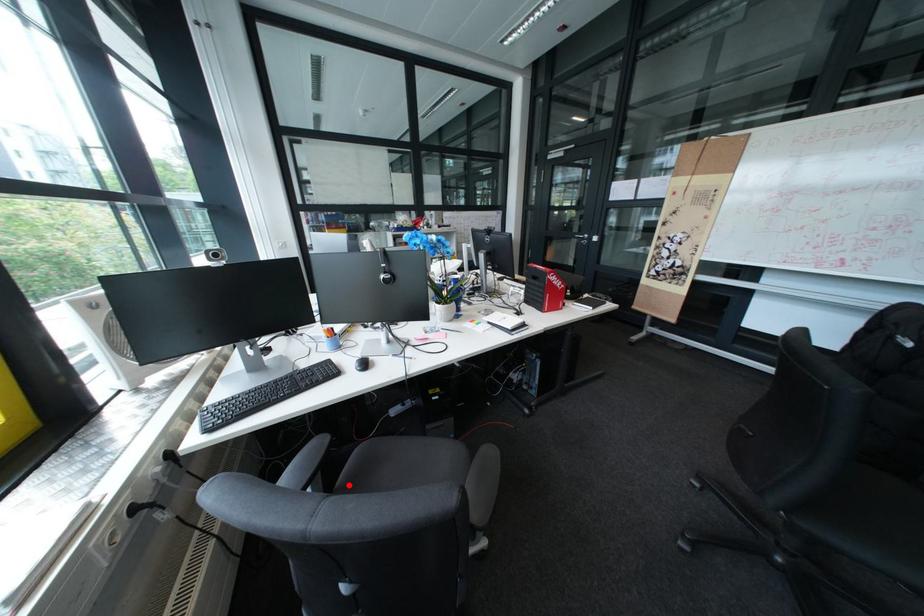
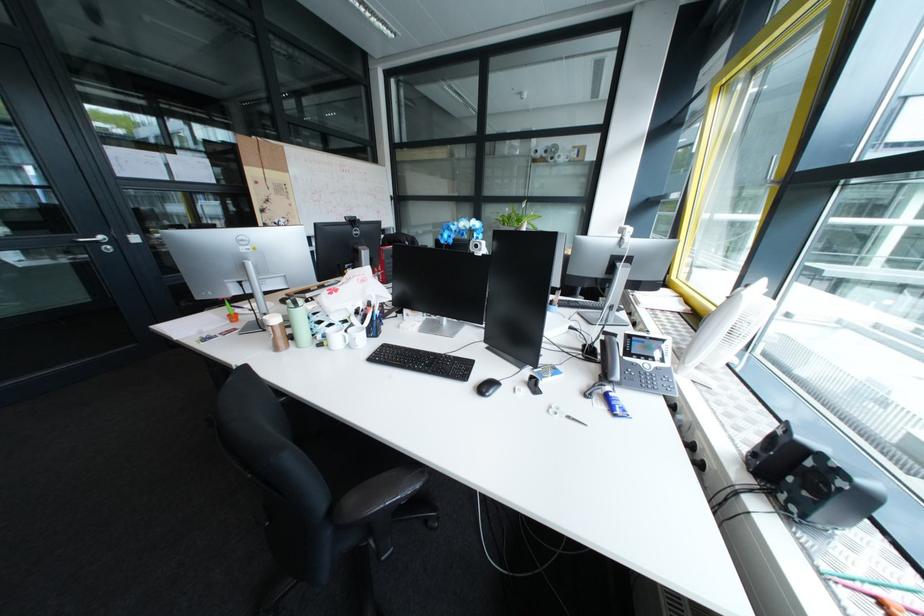
Question: I am providing you with two images of the same scene from different viewpoints. A red point is marked on the first image. Can you still see the location of the red point in image 2?

Choices:
 (A) Yes
 (B) No

Answer: (B)